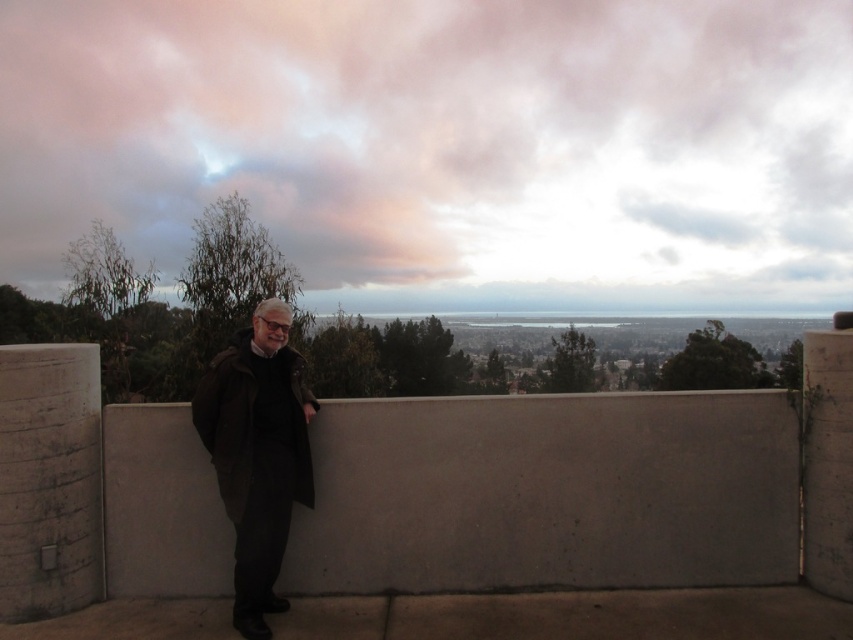
Who is higher up, pink fluffy cloud at upper center or gray concrete ledge at center?

pink fluffy cloud at upper center is above.

Is pink fluffy cloud at upper center in front of gray concrete ledge at center?

No, it is not.

Is point (619, 208) closer to camera compared to point (691, 486)?

No.

Identify the location of pink fluffy cloud at upper center. (445, 145).

In the scene shown: Between pink fluffy cloud at upper center and dark brown leather coat at center, which one appears on the left side from the viewer's perspective?

Positioned to the left is dark brown leather coat at center.

Does pink fluffy cloud at upper center have a lesser height compared to dark brown leather coat at center?

No, pink fluffy cloud at upper center is not shorter than dark brown leather coat at center.

Who is more distant from viewer, [450,8] or [213,365]?

The point [450,8] is behind.

I want to click on pink fluffy cloud at upper center, so click(x=445, y=145).

Locate an element on the screen. gray concrete ledge at center is located at coordinates (548, 493).

I want to click on gray concrete ledge at center, so click(x=548, y=493).